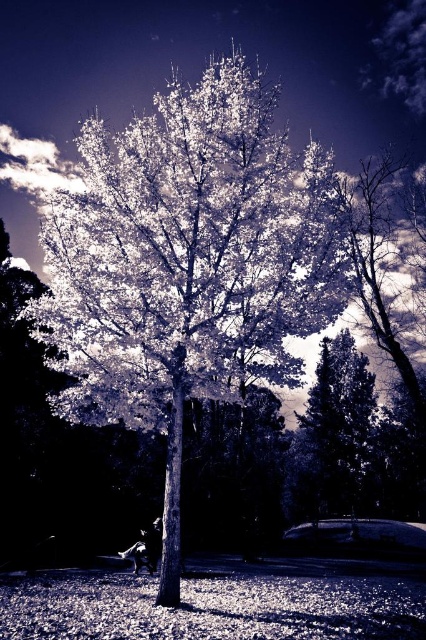
You are a photographer wanting to capture both the white textured tree at center and the smooth bark tree at lower right in a single frame. Based on their positions, which tree should you focus on first to ensure both are in the shot?

The white textured tree at center is to the left of the smooth bark tree at lower right, so you should focus on the white textured tree at center first to ensure both are in the frame.

You are an artist analyzing the composition of the infrared image. You observe the white textured tree at center and the smooth bark tree at lower right. Which tree is positioned higher in the image?

The white textured tree at center is positioned higher in the image than the smooth bark tree at lower right.

You are an artist trying to paint the scene from the image. You want to focus on the white textured tree at center and the smooth bark tree at lower right. Which tree should you paint first if you follow the rule of painting closer objects before distant ones?

The white textured tree at center should be painted first because it is closer to the viewer than the smooth bark tree at lower right.